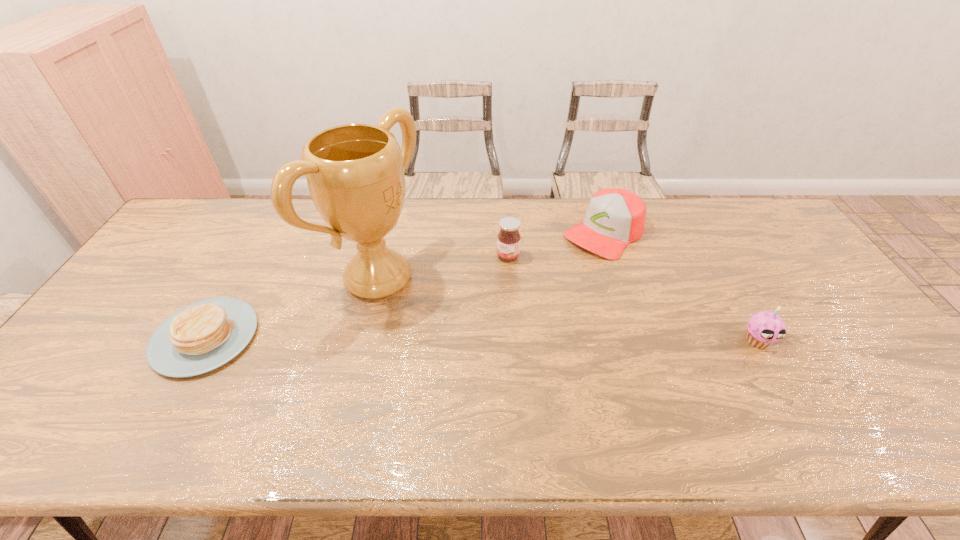
Find the location of a particular element. free space that is in between the cupcake and the fourth object from left to right is located at coordinates (x=681, y=286).

The width and height of the screenshot is (960, 540). In order to click on vacant region between the second object from right to left and the cupcake in this screenshot , I will do `click(681, 286)`.

This screenshot has height=540, width=960. Find the location of `free space between the cupcake and the shortest object`. free space between the cupcake and the shortest object is located at coordinates click(481, 339).

Identify the location of vacant area that lies between the third object from left to right and the shortest object. (357, 297).

The height and width of the screenshot is (540, 960). I want to click on free space between the shortest object and the cupcake, so click(481, 339).

At what (x,y) coordinates should I click in order to perform the action: click on blank region between the rightmost object and the tallest object. Please return your answer as a coordinate pair (x, y). Image resolution: width=960 pixels, height=540 pixels. Looking at the image, I should click on (567, 309).

The width and height of the screenshot is (960, 540). In order to click on object that ranks as the closest to the cupcake in this screenshot , I will do (x=615, y=217).

I want to click on object that is the third closest to the cupcake, so click(x=355, y=172).

You are a GUI agent. You are given a task and a screenshot of the screen. Output one action in this format:
    pyautogui.click(x=<x>, y=<y>)
    Task: Click on the free space that satisfies the following two spatial constraints: 1. on the back side of the baseball cap; 2. on the left side of the shortest object
    The height and width of the screenshot is (540, 960).
    Given the screenshot: What is the action you would take?
    pyautogui.click(x=265, y=232)

Locate an element on the screen. The image size is (960, 540). free space that satisfies the following two spatial constraints: 1. on the back side of the jam; 2. on the right side of the leftmost object is located at coordinates (252, 256).